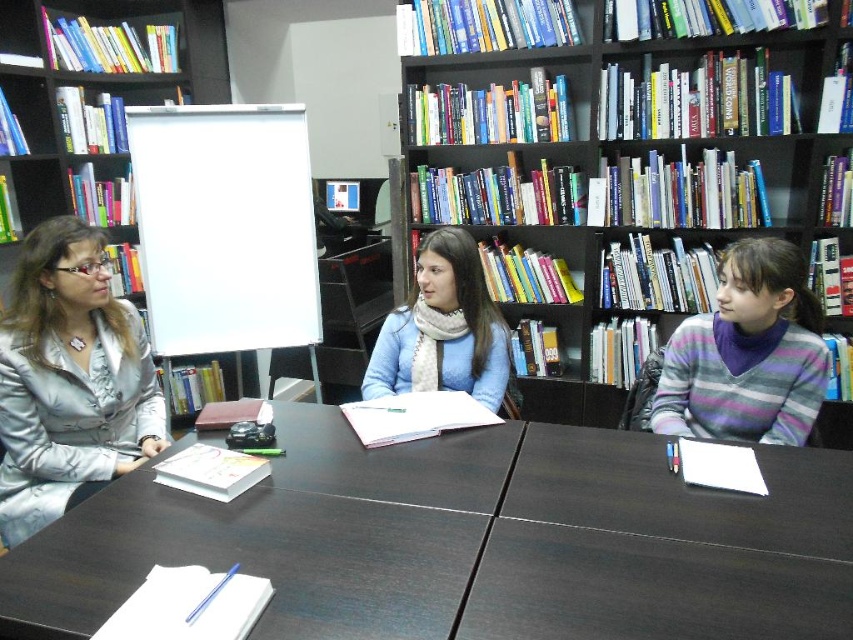
Which of these two, dark wood table at center or black matte bookcase at upper center, stands shorter?

dark wood table at center is shorter.

Can you confirm if dark wood table at center is positioned above black matte bookcase at upper center?

No.

At what (x,y) coordinates should I click in order to perform the action: click on dark wood table at center. Please return your answer as a coordinate pair (x, y). The width and height of the screenshot is (853, 640). Looking at the image, I should click on (468, 541).

Which is below, multicolored wooden bookcase at upper center or blue scarf at center?

blue scarf at center

Who is higher up, multicolored wooden bookcase at upper center or blue scarf at center?

multicolored wooden bookcase at upper center is higher up.

Which is in front, point (83, 81) or point (473, 273)?

Point (473, 273)

Find the location of a particular element. The height and width of the screenshot is (640, 853). multicolored wooden bookcase at upper center is located at coordinates [99, 86].

Does striped sweater at right appear under blue scarf at center?

Indeed, striped sweater at right is positioned under blue scarf at center.

Does point (784, 266) come closer to viewer compared to point (416, 364)?

Yes.

Is point (804, 422) closer to viewer compared to point (444, 300)?

Yes, point (804, 422) is closer to viewer.

Image resolution: width=853 pixels, height=640 pixels. In order to click on striped sweater at right in this screenshot , I will do `click(747, 353)`.